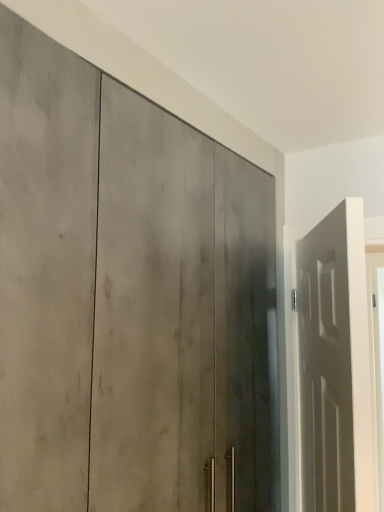
Question: Which direction should I rotate to look at matte gray door at center, which is counted as the 2th door, starting from the right?

Choices:
 (A) right
 (B) left

Answer: (B)

Question: Is white matte door at right, positioned as the first door in right-to-left order, next to matte gray door at center, which is counted as the 2th door, starting from the right, and touching it?

Choices:
 (A) no
 (B) yes

Answer: (A)

Question: Is white matte door at right, acting as the second door starting from the left, not near matte gray door at center, acting as the first door starting from the left?

Choices:
 (A) yes
 (B) no

Answer: (B)

Question: Is white matte door at right, positioned as the first door in right-to-left order, positioned with its back to matte gray door at center, acting as the first door starting from the left?

Choices:
 (A) yes
 (B) no

Answer: (A)

Question: From the image's perspective, is white matte door at right, acting as the second door starting from the left, located above matte gray door at center, acting as the first door starting from the left?

Choices:
 (A) yes
 (B) no

Answer: (B)

Question: From a real-world perspective, does white matte door at right, positioned as the first door in right-to-left order, sit lower than matte gray door at center, which is counted as the 2th door, starting from the right?

Choices:
 (A) no
 (B) yes

Answer: (B)

Question: Considering the relative sizes of white matte door at right, positioned as the first door in right-to-left order, and matte gray door at center, acting as the first door starting from the left, in the image provided, is white matte door at right, positioned as the first door in right-to-left order, bigger than matte gray door at center, acting as the first door starting from the left,?

Choices:
 (A) yes
 (B) no

Answer: (B)

Question: Can you see matte gray door at center, which is counted as the 2th door, starting from the right, touching white matte door at right, acting as the second door starting from the left?

Choices:
 (A) yes
 (B) no

Answer: (B)

Question: Considering the relative sizes of matte gray door at center, acting as the first door starting from the left, and white matte door at right, acting as the second door starting from the left, in the image provided, is matte gray door at center, acting as the first door starting from the left, shorter than white matte door at right, acting as the second door starting from the left,?

Choices:
 (A) yes
 (B) no

Answer: (B)

Question: Is matte gray door at center, acting as the first door starting from the left, at the right side of white matte door at right, positioned as the first door in right-to-left order?

Choices:
 (A) no
 (B) yes

Answer: (A)

Question: From the image's perspective, is matte gray door at center, acting as the first door starting from the left, on white matte door at right, positioned as the first door in right-to-left order?

Choices:
 (A) yes
 (B) no

Answer: (A)

Question: From a real-world perspective, does matte gray door at center, which is counted as the 2th door, starting from the right, sit lower than white matte door at right, acting as the second door starting from the left?

Choices:
 (A) no
 (B) yes

Answer: (A)

Question: From a real-world perspective, does matte gray door at center, acting as the first door starting from the left, stand above white matte door at right, acting as the second door starting from the left?

Choices:
 (A) yes
 (B) no

Answer: (A)

Question: Considering the relative positions of matte gray door at center, which is counted as the 2th door, starting from the right, and white matte door at right, positioned as the first door in right-to-left order, in the image provided, is matte gray door at center, which is counted as the 2th door, starting from the right, to the left or to the right of white matte door at right, positioned as the first door in right-to-left order,?

Choices:
 (A) right
 (B) left

Answer: (B)